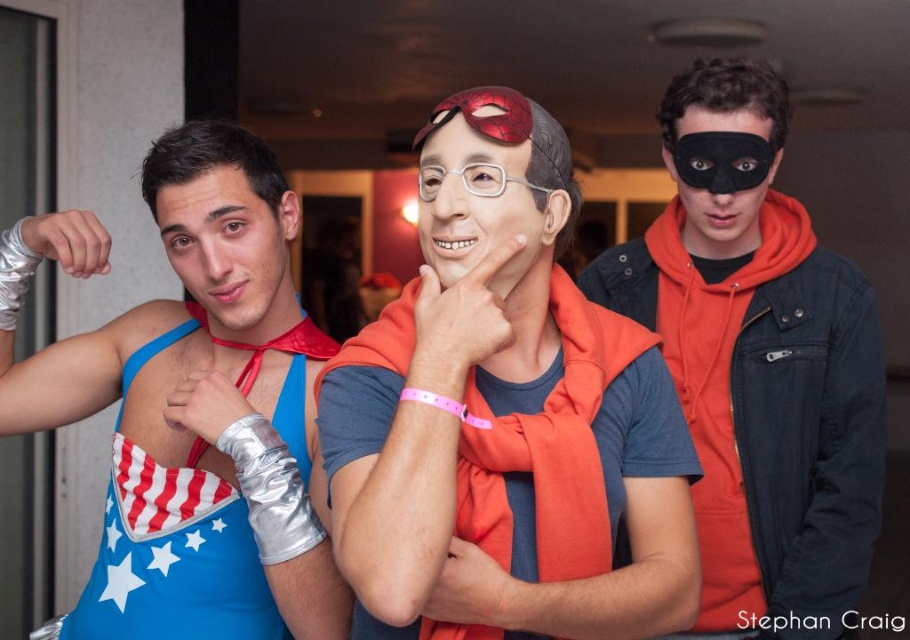
You are a photographer standing at the camera position. You need to adjust your camera focus to capture the black matte mask at upper right clearly. What is the minimum distance you should set your focus to ensure it is sharp?

The minimum distance to set the focus is 1.66 meters because the black matte mask at upper right is located exactly 1.66 meters away from the camera.

You are taking a photo of two points in the image. The first point is at coordinates point (93, 340) and the second point is at point (749, 204). Which point will appear larger in your photo?

Point (93, 340) is closer to the camera than point (749, 204), so it will appear larger in the photo.